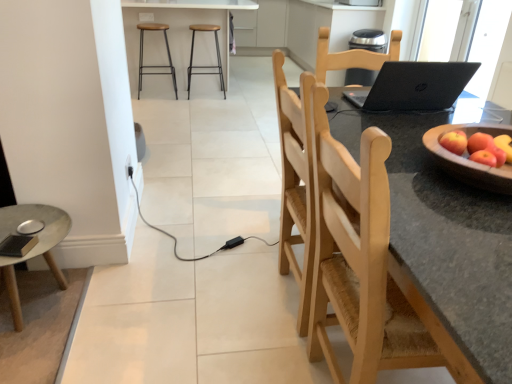
You are a GUI agent. You are given a task and a screenshot of the screen. Output one action in this format:
    pyautogui.click(x=<x>, y=<y>)
    Task: Click on the free region on the left part of red matte apple at right
    
    Given the screenshot: What is the action you would take?
    pyautogui.click(x=415, y=169)